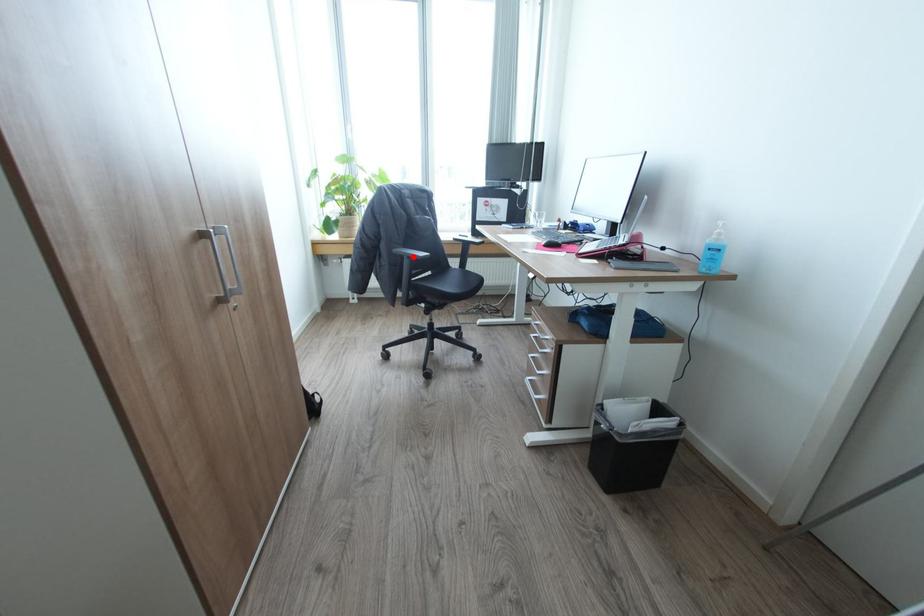
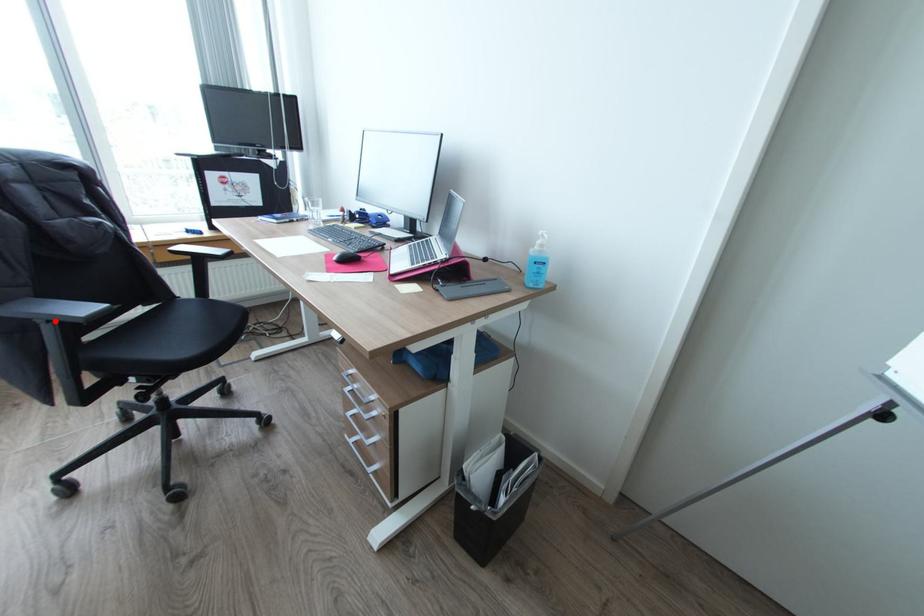
I am providing you with two images of the same scene from different viewpoints. A red point is marked on the first image and another point is marked on the second image. Is the marked point in image1 the same physical position as the marked point in image2?

Yes